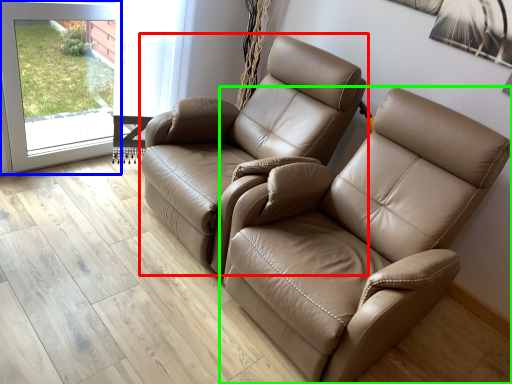
Question: Which object is positioned farthest from chair (highlighted by a red box)? Select from screen door (highlighted by a blue box) and chair (highlighted by a green box).

Choices:
 (A) screen door
 (B) chair

Answer: (A)